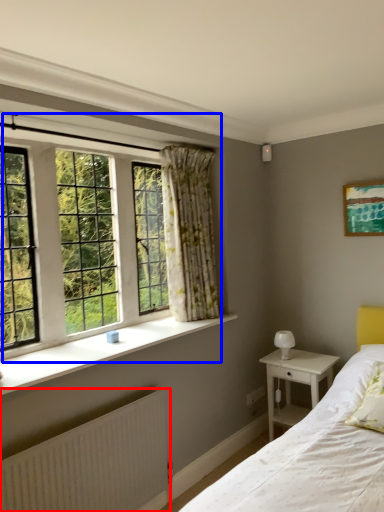
Question: Which point is further to the camera, radiator (highlighted by a red box) or window (highlighted by a blue box)?

Choices:
 (A) radiator
 (B) window

Answer: (B)